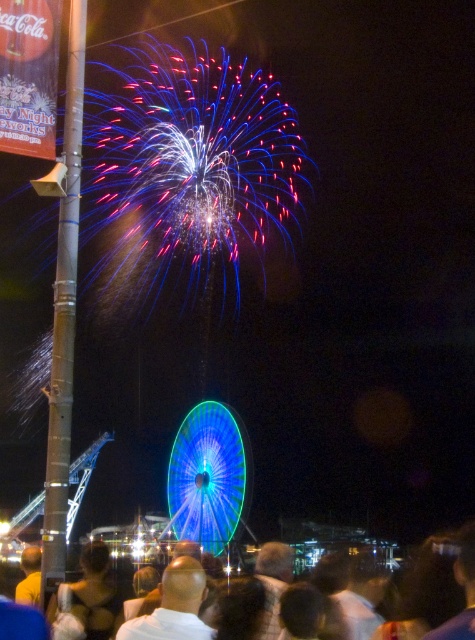
You are standing at the center of the image and want to locate the metallic pole at left. In which direction should you look to find it?

The metallic pole at left is located at point coordinates that are to the left side of the image, so you should look to your left to find it.

You are a photographer at the fireworks event. You want to capture a photo that includes both the metallic pole at left and the dark hair at lower center. Which object should you focus on first to ensure both are in frame?

You should focus on the metallic pole at left first because it is taller than the dark hair at lower center, so adjusting the camera angle to include its full height will naturally include the shorter dark hair at lower center in the frame.